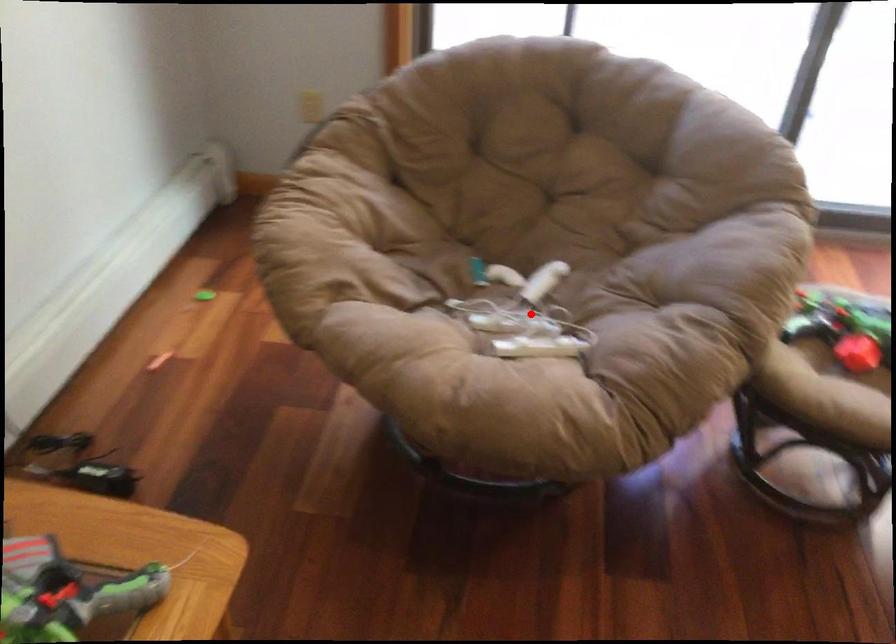
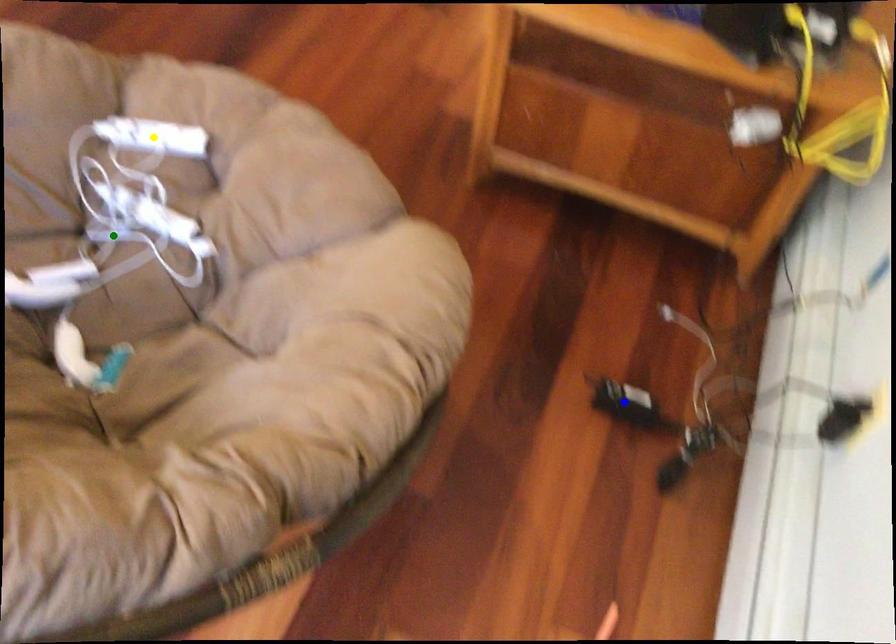
Question: I am providing you with two images of the same scene from different viewpoints. A red point is marked on the first image. You are given multiple points on the second image. Can you choose the point in image 2 that corresponds to the point in image 1?

Choices:
 (A) yellow point
 (B) green point
 (C) blue point

Answer: (B)